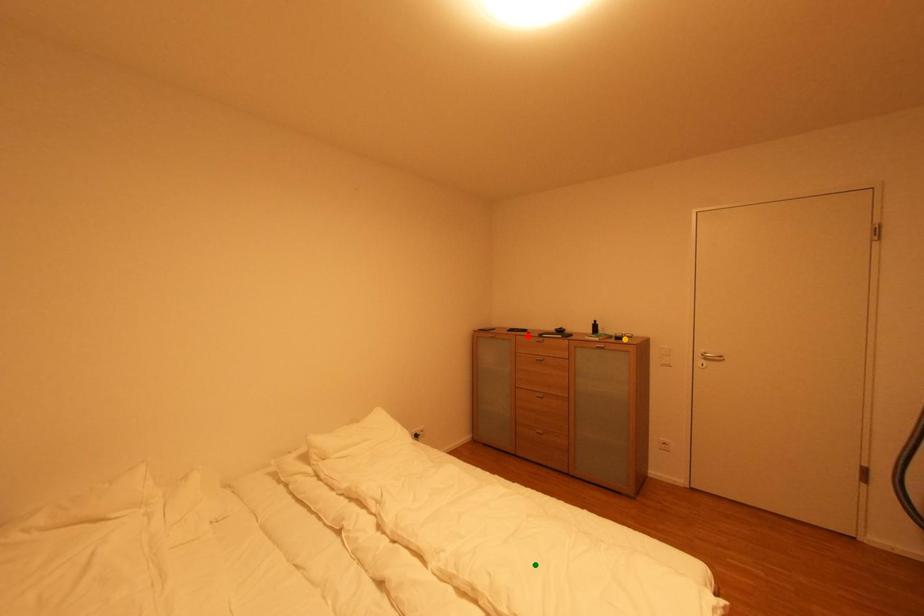
Order these from nearest to farthest:
A) red point
B) green point
C) orange point

green point → orange point → red point